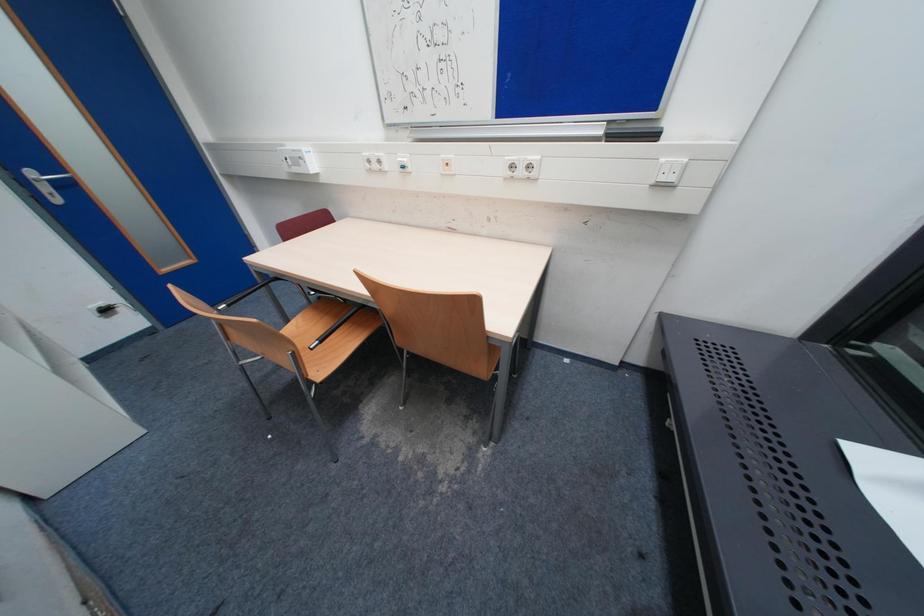
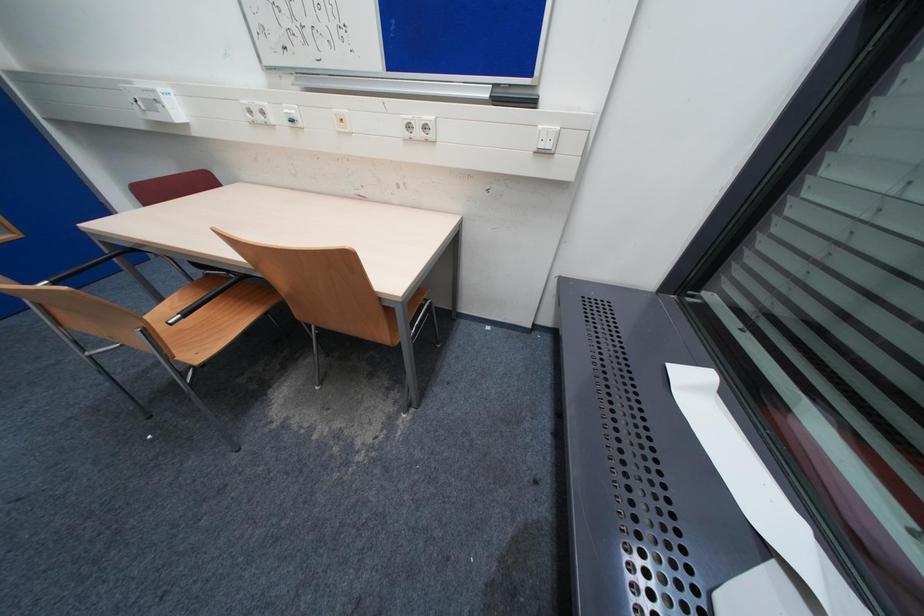
Question: Which direction would the cameraman need to move to produce the second image? Reply with the corresponding letter.

Choices:
 (A) Left
 (B) Right
 (C) Forward
 (D) Backward

Answer: (B)